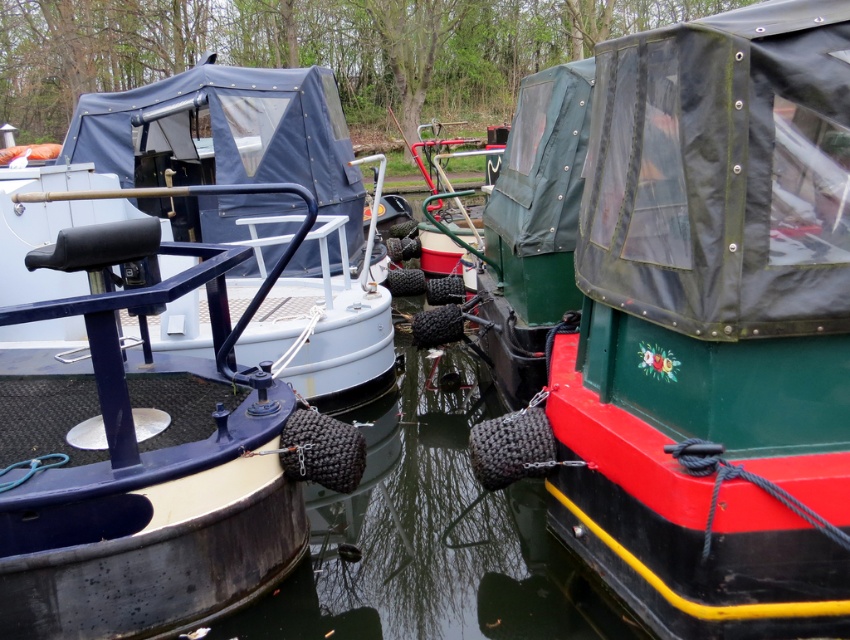
Question: Does green glossy boat at center have a larger size compared to matte blue boat at left?

Choices:
 (A) yes
 (B) no

Answer: (B)

Question: Does green glossy boat at center appear under smooth rubber fender at center?

Choices:
 (A) yes
 (B) no

Answer: (B)

Question: Which object is the closest to the matte blue boat at left?

Choices:
 (A) smooth rubber fender at center
 (B) green glossy boat at center

Answer: (A)

Question: Where is smooth rubber fender at center located in relation to matte blue boat at left in the image?

Choices:
 (A) above
 (B) below

Answer: (B)

Question: Which object is closer to the camera taking this photo?

Choices:
 (A) green glossy boat at center
 (B) matte blue boat at left

Answer: (A)

Question: Considering the real-world distances, which object is farthest from the matte blue boat at left?

Choices:
 (A) green glossy boat at center
 (B) smooth rubber fender at center

Answer: (A)